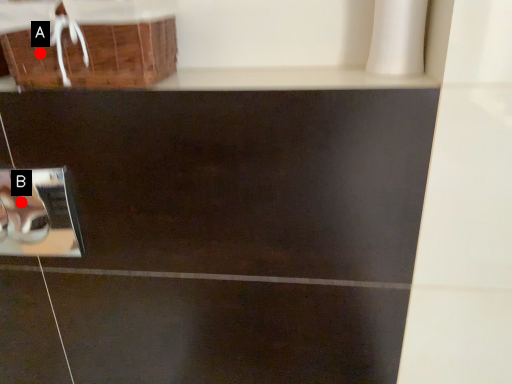
Question: Two points are circled on the image, labeled by A and B beside each circle. Which of the following is the closest to the observer?

Choices:
 (A) A is closer
 (B) B is closer

Answer: (A)